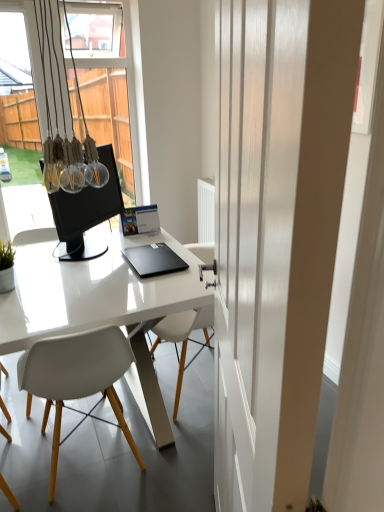
Question: Relative to black matte laptop at center, is translucent glass light fixture at upper left in front or behind?

Choices:
 (A) behind
 (B) front

Answer: (A)

Question: Considering the positions of translucent glass light fixture at upper left and black matte laptop at center in the image, is translucent glass light fixture at upper left taller or shorter than black matte laptop at center?

Choices:
 (A) short
 (B) tall

Answer: (B)

Question: Considering the real-world distances, which object is closest to the matte black monitor at center?

Choices:
 (A) black matte laptop at center
 (B) white plastic chair at center
 (C) white glossy door at center
 (D) translucent glass light fixture at upper left
 (E) white glossy desk at center

Answer: (D)

Question: Estimate the real-world distances between objects in this image. Which object is closer to the white plastic chair at center?

Choices:
 (A) white glossy desk at center
 (B) matte black monitor at center
 (C) white glossy door at center
 (D) black matte laptop at center
 (E) translucent glass light fixture at upper left

Answer: (A)